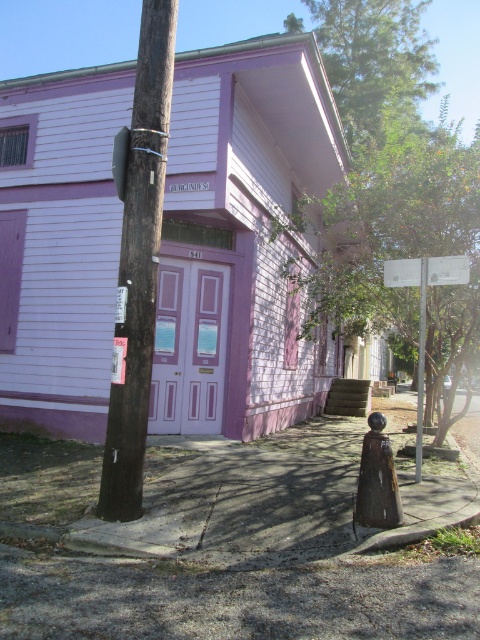
Question: Which object appears closest to the camera in this image?

Choices:
 (A) green leafy tree at center
 (B) brown matte hydrant at lower right
 (C) brown wooden telegraph pole at left

Answer: (B)

Question: Is brown wooden telegraph pole at left wider than metallic silver sign at center?

Choices:
 (A) yes
 (B) no

Answer: (B)

Question: Which object is positioned farthest from the metallic silver sign at center?

Choices:
 (A) green leafy tree at upper center
 (B) brown wooden telegraph pole at left

Answer: (A)

Question: Estimate the real-world distances between objects in this image. Which object is farther from the green leafy tree at center?

Choices:
 (A) brown wooden telegraph pole at left
 (B) metallic silver sign at center

Answer: (A)

Question: Does brown matte hydrant at lower right lie behind metallic silver sign at center?

Choices:
 (A) yes
 (B) no

Answer: (B)

Question: Does green leafy tree at upper center appear under metallic pole at center?

Choices:
 (A) no
 (B) yes

Answer: (A)